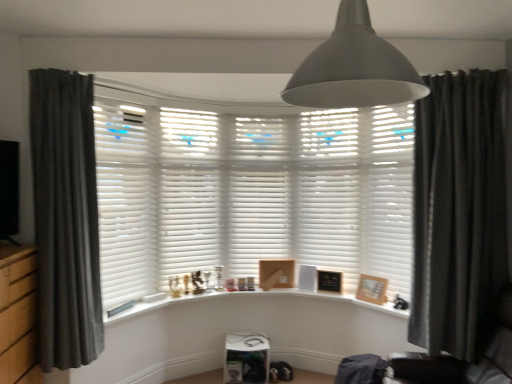
Question: From a real-world perspective, is dark grey fabric curtain at left, which ranks as the second curtain in right-to-left order, beneath black leather swivel chair at lower right?

Choices:
 (A) no
 (B) yes

Answer: (A)

Question: Is dark grey fabric curtain at left, which appears as the first curtain when viewed from the left, directly adjacent to black leather swivel chair at lower right?

Choices:
 (A) no
 (B) yes

Answer: (A)

Question: Is dark grey fabric curtain at left, which ranks as the second curtain in right-to-left order, smaller than black leather swivel chair at lower right?

Choices:
 (A) yes
 (B) no

Answer: (A)

Question: Considering the relative positions of dark grey fabric curtain at left, which appears as the first curtain when viewed from the left, and black leather swivel chair at lower right in the image provided, is dark grey fabric curtain at left, which appears as the first curtain when viewed from the left, behind black leather swivel chair at lower right?

Choices:
 (A) no
 (B) yes

Answer: (B)

Question: Is dark grey fabric curtain at left, which ranks as the second curtain in right-to-left order, facing towards black leather swivel chair at lower right?

Choices:
 (A) yes
 (B) no

Answer: (B)

Question: Is point (430, 193) closer or farther from the camera than point (327, 286)?

Choices:
 (A) farther
 (B) closer

Answer: (B)

Question: Is dark grey velvet curtain at right, placed as the first curtain when sorted from right to left, inside the boundaries of black matte picture frame at center, arranged as the 2th picture frame when viewed from the left, or outside?

Choices:
 (A) inside
 (B) outside

Answer: (B)

Question: Looking at the image, does dark grey velvet curtain at right, which is counted as the 2th curtain, starting from the left, seem bigger or smaller compared to black matte picture frame at center, which is counted as the second picture frame, starting from the back?

Choices:
 (A) big
 (B) small

Answer: (A)

Question: In the image, is dark grey velvet curtain at right, placed as the first curtain when sorted from right to left, on the left side or the right side of black matte picture frame at center, which is counted as the second picture frame, starting from the back?

Choices:
 (A) left
 (B) right

Answer: (B)

Question: Looking at their shapes, would you say wooden picture frame at right, which ranks as the third picture frame in left-to-right order, is wider or thinner than white matte shutter at center, the third shutter positioned from the right?

Choices:
 (A) thin
 (B) wide

Answer: (A)

Question: In terms of height, does wooden picture frame at right, which is the 1th picture frame in right-to-left order, look taller or shorter compared to white matte shutter at center, the third shutter positioned from the right?

Choices:
 (A) tall
 (B) short

Answer: (B)

Question: From a real-world perspective, is wooden picture frame at right, which is counted as the 1th picture frame, starting from the front, physically located above or below white matte shutter at center, the third shutter positioned from the right?

Choices:
 (A) above
 (B) below

Answer: (B)

Question: Choose the correct answer: Is wooden picture frame at right, which ranks as the third picture frame in left-to-right order, inside white matte shutter at center, which appears as the 3th shutter when viewed from the left, or outside it?

Choices:
 (A) outside
 (B) inside

Answer: (A)

Question: Do you think dark grey fabric curtain at left, which appears as the first curtain when viewed from the left, is within white matte shutter at center, which is the 4th shutter from left to right, or outside of it?

Choices:
 (A) outside
 (B) inside

Answer: (A)

Question: From the image's perspective, relative to white matte shutter at center, which is the 2th shutter from right to left, is dark grey fabric curtain at left, which appears as the first curtain when viewed from the left, above or below?

Choices:
 (A) above
 (B) below

Answer: (B)